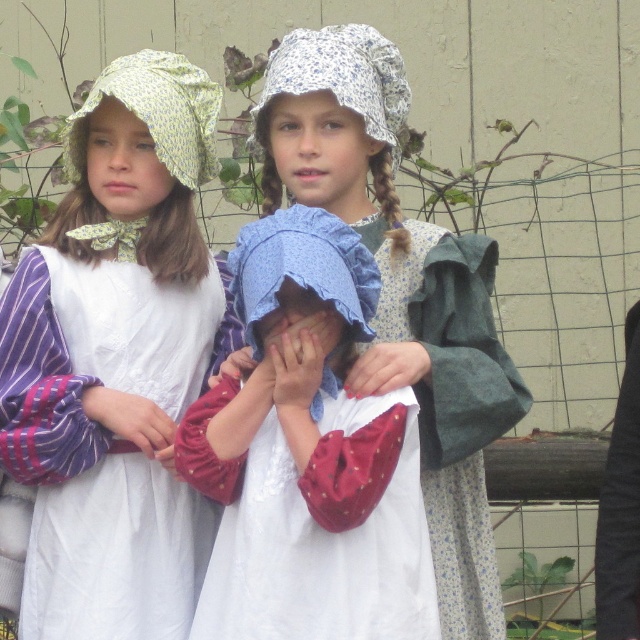
Question: Which of the following is the closest to the observer?

Choices:
 (A) matte red fabric at center
 (B) smooth red fabric at center

Answer: (A)

Question: Is white cotton dress at center below blue cotton bonnet at center?

Choices:
 (A) no
 (B) yes

Answer: (B)

Question: Where is matte yellow bonnet at left located in relation to smooth red fabric at center in the image?

Choices:
 (A) below
 (B) above

Answer: (B)

Question: Which of the following is the closest to the observer?

Choices:
 (A) matte yellow bonnet at left
 (B) blue cotton bonnet at center
 (C) smooth red fabric at center
 (D) smooth skin hand at center

Answer: (D)

Question: Among these objects, which one is nearest to the camera?

Choices:
 (A) matte yellow bonnet at left
 (B) white cotton dress at center

Answer: (B)

Question: Can you confirm if smooth red fabric at center is positioned below smooth skin hand at center?

Choices:
 (A) yes
 (B) no

Answer: (A)